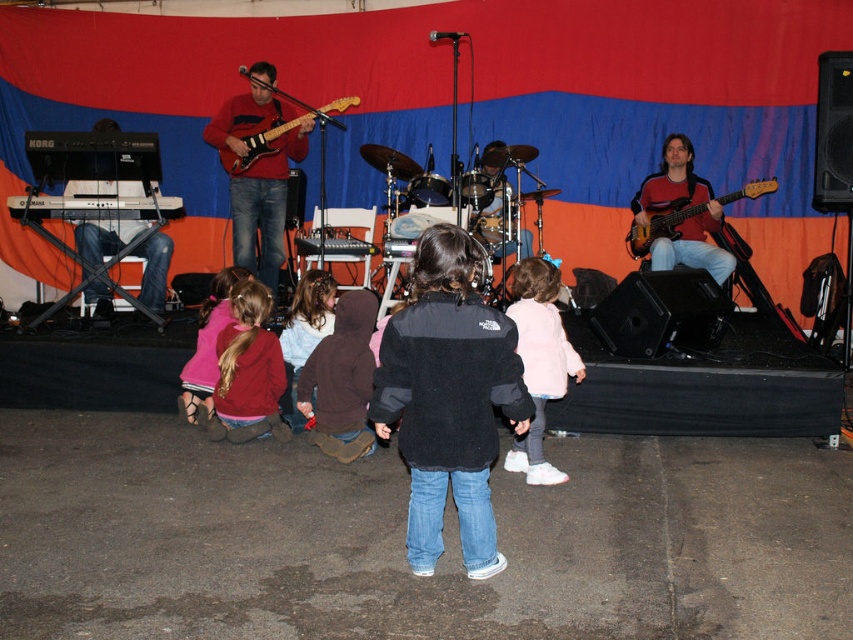
Can you confirm if brown suede jacket at center is smaller than light pink fleece jacket at center?

No, brown suede jacket at center is not smaller than light pink fleece jacket at center.

Who is more forward, (352, 422) or (305, 352)?

Point (352, 422) is more forward.

Locate an element on the screen. The width and height of the screenshot is (853, 640). brown suede jacket at center is located at coordinates (341, 380).

Is velvet maroon hoodie at lower left taller than pink fleece jacket at lower left?

In fact, velvet maroon hoodie at lower left may be shorter than pink fleece jacket at lower left.

Is velvet maroon hoodie at lower left further to camera compared to pink fleece jacket at lower left?

No.

Is point (264, 285) positioned in front of point (210, 333)?

Yes, it is in front of point (210, 333).

Identify the location of velvet maroon hoodie at lower left. (248, 371).

Does matte red electric guitar at left come in front of matte red guitar at right?

Yes, matte red electric guitar at left is closer to the viewer.

Can you confirm if matte red electric guitar at left is shorter than matte red guitar at right?

No.

Who is more distant from viewer, (245, 97) or (665, 189)?

Positioned behind is point (665, 189).

Find the location of `matte red electric guitar at left`. matte red electric guitar at left is located at coordinates (264, 205).